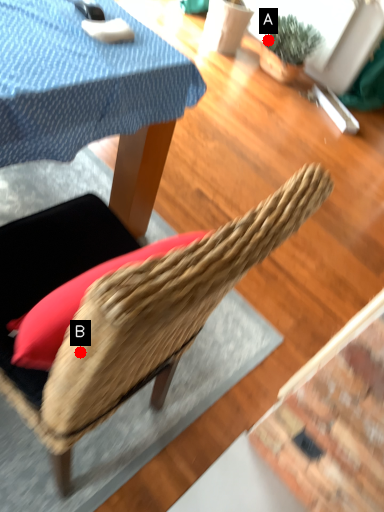
Question: Two points are circled on the image, labeled by A and B beside each circle. Among these points, which one is nearest to the camera?

Choices:
 (A) A is closer
 (B) B is closer

Answer: (B)